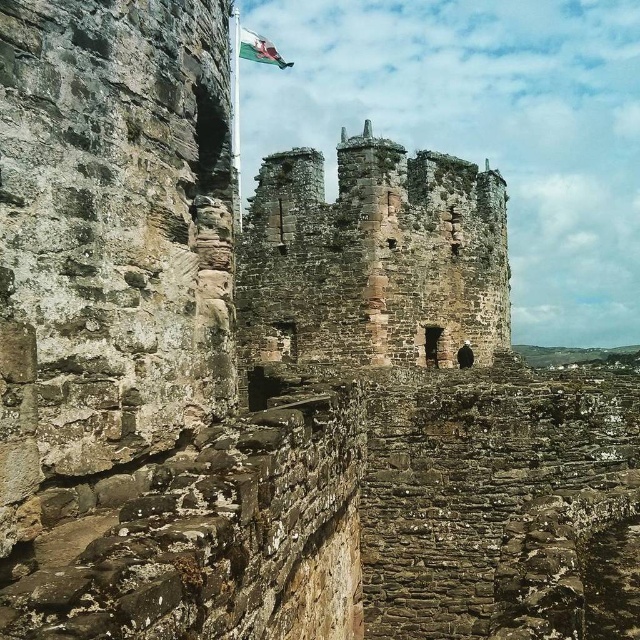
You are a tourist standing at the base of the castle ruins. You notice the rusty stone tower at center and the white fabric flag at upper center. Which object is physically nearer to you as you look towards the castle?

The rusty stone tower at center is closer to the viewer than the white fabric flag at upper center, so the tower is physically nearer to you.

You are a medieval knight standing at the base of the rusty stone tower at center. You notice the white fabric flag at upper center flying high above you. Can you determine if the flag is taller than the tower?

The rusty stone tower at center is much taller as white fabric flag at upper center, so the flag is not taller than the tower.